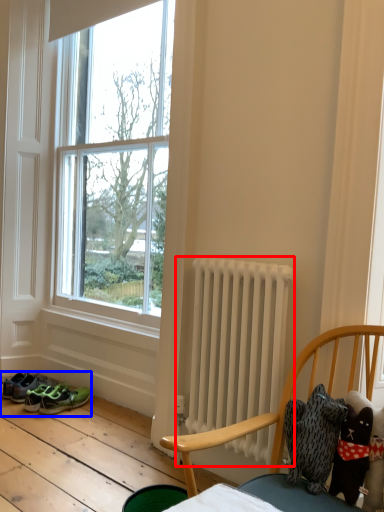
Question: Which point is closer to the camera, radiator (highlighted by a red box) or footwear (highlighted by a blue box)?

Choices:
 (A) radiator
 (B) footwear

Answer: (A)